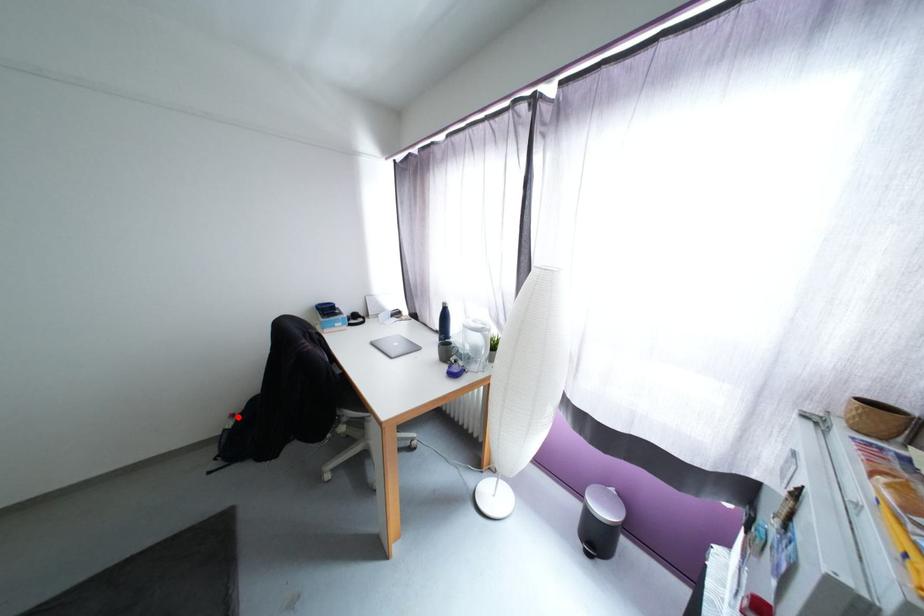
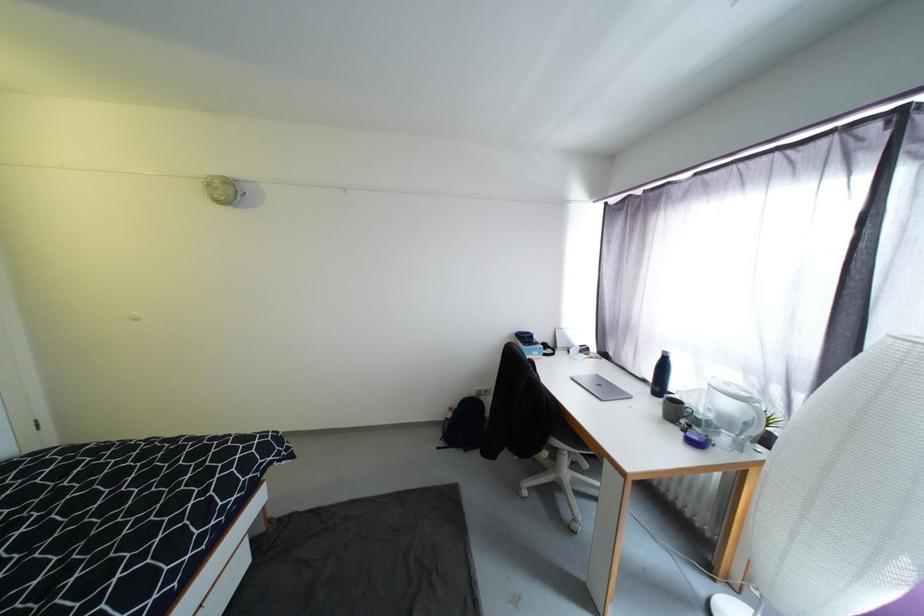
Question: A red point is marked in image1. In image2, is the corresponding 3D point closer to the camera or farther? Reply with the corresponding letter.

Choices:
 (A) The corresponding 3D point is closer.
 (B) The corresponding 3D point is farther.

Answer: (A)